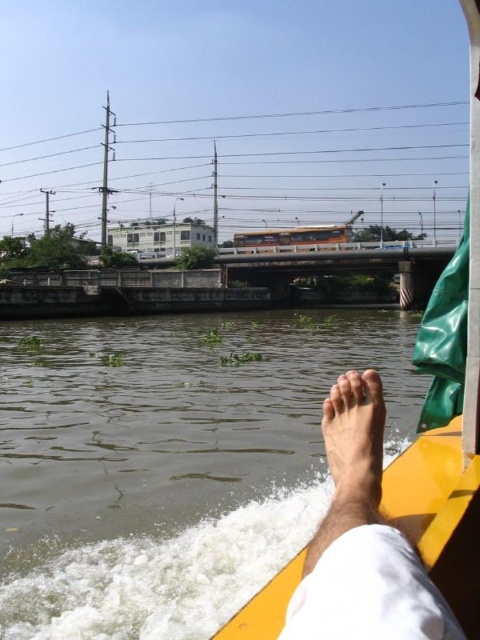
Who is shorter, skinny barefoot at lower center or skinny barefoot at lower right?

Standing shorter between the two is skinny barefoot at lower right.

Does point (359, 470) come closer to viewer compared to point (340, 516)?

No, it is not.

Locate an element on the screen. Image resolution: width=480 pixels, height=640 pixels. skinny barefoot at lower center is located at coordinates (361, 540).

Is point (96, 396) positioned before point (350, 474)?

No, it is behind (350, 474).

Does point (261, 570) come behind point (367, 481)?

Yes, it is.

Identify the location of brown murky water at lower left. (170, 461).

Which of these two, brown murky water at lower left or skinny barefoot at lower center, stands taller?

With more height is brown murky water at lower left.

Which is below, brown murky water at lower left or skinny barefoot at lower center?

Positioned lower is brown murky water at lower left.

The width and height of the screenshot is (480, 640). Identify the location of brown murky water at lower left. (170, 461).

This screenshot has height=640, width=480. Identify the location of brown murky water at lower left. click(170, 461).